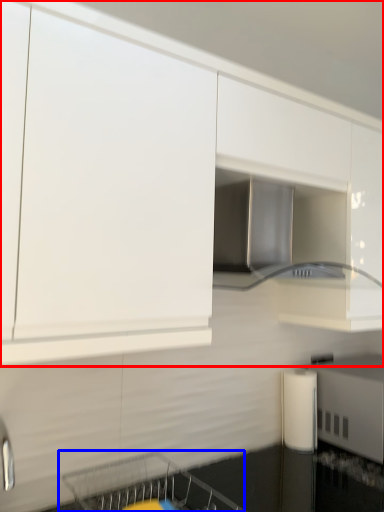
Question: Which object is further to the camera taking this photo, cabinetry (highlighted by a red box) or dish washer (highlighted by a blue box)?

Choices:
 (A) cabinetry
 (B) dish washer

Answer: (B)